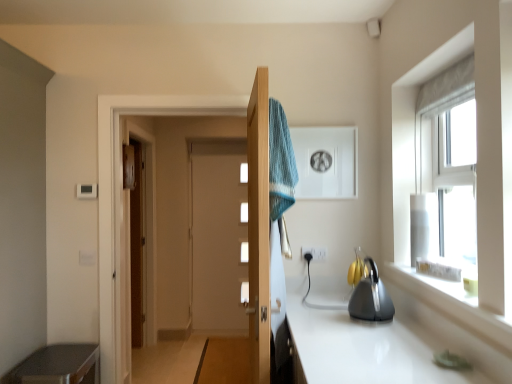
This screenshot has height=384, width=512. Find the location of `clear glass window at upper right`. clear glass window at upper right is located at coordinates (446, 175).

The width and height of the screenshot is (512, 384). Identify the location of white plastic electric outlet at center. (308, 252).

Image resolution: width=512 pixels, height=384 pixels. Identify the location of metallic gray cabinet at lower left. (58, 365).

From a real-world perspective, is clear glass window at upper right physically below white plastic electric outlet at center?

No, from a real-world perspective, clear glass window at upper right is not beneath white plastic electric outlet at center.

How different are the orientations of clear glass window at upper right and white plastic electric outlet at center in degrees?

The angle between the facing direction of clear glass window at upper right and the facing direction of white plastic electric outlet at center is 89.5 degrees.

Can you confirm if clear glass window at upper right is wider than white plastic electric outlet at center?

Correct, the width of clear glass window at upper right exceeds that of white plastic electric outlet at center.

Is clear glass window at upper right not near white plastic electric outlet at center?

clear glass window at upper right is near white plastic electric outlet at center, not far away.

Can blue knitted towel at center be found inside white glossy medicine cabinet at upper center?

That's incorrect, blue knitted towel at center is not inside white glossy medicine cabinet at upper center.

Can you tell me how much white glossy medicine cabinet at upper center and blue knitted towel at center differ in facing direction?

white glossy medicine cabinet at upper center and blue knitted towel at center are facing 92 degrees away from each other.

Does white glossy medicine cabinet at upper center touch blue knitted towel at center?

white glossy medicine cabinet at upper center and blue knitted towel at center are not in contact.

Which is more to the left, white glossy medicine cabinet at upper center or blue knitted towel at center?

blue knitted towel at center.

Considering the relative positions of wooden door at center and white plastic electric outlet at center in the image provided, is wooden door at center to the left or to the right of white plastic electric outlet at center?

wooden door at center is to the left of white plastic electric outlet at center.

From a real-world perspective, who is located higher, wooden door at center or white plastic electric outlet at center?

wooden door at center is physically above.

Is the depth of wooden door at center greater than that of white plastic electric outlet at center?

No, it is in front of white plastic electric outlet at center.

From a real-world perspective, which is physically below, metallic gray cabinet at lower left or blue knitted towel at center?

metallic gray cabinet at lower left.

Is metallic gray cabinet at lower left next to blue knitted towel at center?

metallic gray cabinet at lower left is not next to blue knitted towel at center, and they're not touching.

How distant is metallic gray cabinet at lower left from blue knitted towel at center?

metallic gray cabinet at lower left and blue knitted towel at center are 1.43 meters apart from each other.

Considering the points (312, 259) and (81, 378), which point is in front, point (312, 259) or point (81, 378)?

Point (81, 378)

Does white plastic electric outlet at center have a smaller size compared to metallic gray cabinet at lower left?

Yes.

Is metallic gray cabinet at lower left at the back of white plastic electric outlet at center?

No, metallic gray cabinet at lower left is not at the back of white plastic electric outlet at center.

From a real-world perspective, which object stands above the other?

white plastic electric outlet at center.

Does blue knitted towel at center turn towards clear glass window at upper right?

Yes, blue knitted towel at center is aimed at clear glass window at upper right.

Does blue knitted towel at center have a greater width compared to clear glass window at upper right?

Correct, the width of blue knitted towel at center exceeds that of clear glass window at upper right.

Could clear glass window at upper right be considered to be inside blue knitted towel at center?

No, clear glass window at upper right is located outside of blue knitted towel at center.

Could you tell me if white glossy medicine cabinet at upper center is facing wooden door at center?

No, white glossy medicine cabinet at upper center does not turn towards wooden door at center.

Which of these two, white glossy medicine cabinet at upper center or wooden door at center, stands taller?

wooden door at center is taller.

This screenshot has width=512, height=384. Identify the location of medicine cabinet above the wooden door at center (from a real-world perspective). (326, 162).

The image size is (512, 384). What are the coordinates of `electric outlet below the clear glass window at upper right (from the image's perspective)` in the screenshot? It's located at (308, 252).

You are a GUI agent. You are given a task and a screenshot of the screen. Output one action in this format:
    pyautogui.click(x=<x>, y=<y>)
    Task: Click on the medicine cabinet that appears behind the blue knitted towel at center
    
    Given the screenshot: What is the action you would take?
    pyautogui.click(x=326, y=162)

Considering their positions, is wooden door at center positioned further to blue knitted towel at center than white glossy medicine cabinet at upper center?

white glossy medicine cabinet at upper center lies further to blue knitted towel at center than the other object.

From the image, which object appears to be farther from metallic gray cabinet at lower left, wooden door at center or white plastic electric outlet at center?

Among the two, white plastic electric outlet at center is located further to metallic gray cabinet at lower left.

Based on their spatial positions, is white glossy medicine cabinet at upper center or wooden door at center closer to metallic gray cabinet at lower left?

Among the two, wooden door at center is located nearer to metallic gray cabinet at lower left.

Looking at the image, which one is located further to clear glass window at upper right, white glossy medicine cabinet at upper center or metallic gray cabinet at lower left?

The object further to clear glass window at upper right is metallic gray cabinet at lower left.

Which object lies further to the anchor point metallic gray cabinet at lower left, white plastic electric outlet at center or blue knitted towel at center?

Based on the image, white plastic electric outlet at center appears to be further to metallic gray cabinet at lower left.

Which object lies further to the anchor point metallic gray cabinet at lower left, white plastic electric outlet at center or white glossy medicine cabinet at upper center?

Among the two, white glossy medicine cabinet at upper center is located further to metallic gray cabinet at lower left.

Looking at the image, which one is located closer to metallic gray cabinet at lower left, wooden door at center or white glossy medicine cabinet at upper center?

Among the two, wooden door at center is located nearer to metallic gray cabinet at lower left.

Consider the image. From the image, which object appears to be farther from clear glass window at upper right, wooden door at center or white glossy medicine cabinet at upper center?

Based on the image, wooden door at center appears to be further to clear glass window at upper right.

The width and height of the screenshot is (512, 384). I want to click on electric outlet located between blue knitted towel at center and clear glass window at upper right in the left-right direction, so click(308, 252).

Where is `medicine cabinet between wooden door at center and clear glass window at upper right`? medicine cabinet between wooden door at center and clear glass window at upper right is located at coordinates (326, 162).

The height and width of the screenshot is (384, 512). What are the coordinates of `door between metallic gray cabinet at lower left and clear glass window at upper right from left to right` in the screenshot? It's located at (259, 227).

Where is `medicine cabinet located between clear glass window at upper right and white plastic electric outlet at center in the depth direction`? The height and width of the screenshot is (384, 512). medicine cabinet located between clear glass window at upper right and white plastic electric outlet at center in the depth direction is located at coordinates (326, 162).